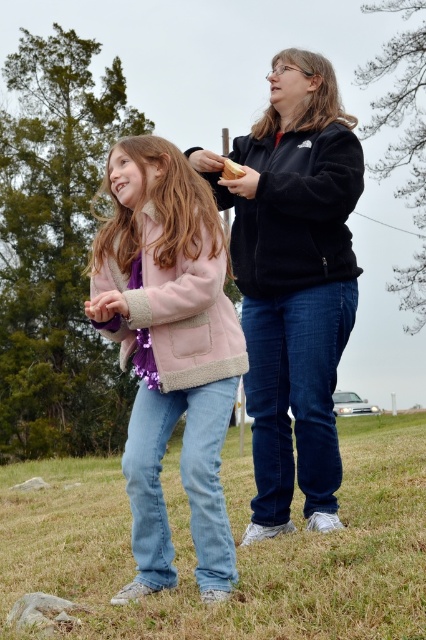
Identify the location of black fleece jacket at center. point(293,282).

Which is more to the left, black fleece jacket at center or slightly toasted bread at upper center?

From the viewer's perspective, slightly toasted bread at upper center appears more on the left side.

Who is more distant from viewer, (271,212) or (232,168)?

The point (271,212) is more distant.

What are the coordinates of `black fleece jacket at center` in the screenshot? It's located at (293, 282).

Is point (86, 314) positioned behind point (236, 172)?

No, (86, 314) is in front of (236, 172).

Who is shorter, pink fleece jacket at center or slightly toasted bread at upper center?

With less height is slightly toasted bread at upper center.

Where is `pink fleece jacket at center`? pink fleece jacket at center is located at coordinates (169, 352).

Is the position of black fleece jacket at center less distant than that of pink fleece jacket at center?

No, it is behind pink fleece jacket at center.

Can you confirm if black fleece jacket at center is positioned above pink fleece jacket at center?

Yes, black fleece jacket at center is above pink fleece jacket at center.

At what (x,y) coordinates should I click in order to perform the action: click on black fleece jacket at center. Please return your answer as a coordinate pair (x, y). Looking at the image, I should click on (293, 282).

Find the location of `black fleece jacket at center`. black fleece jacket at center is located at coordinates (293, 282).